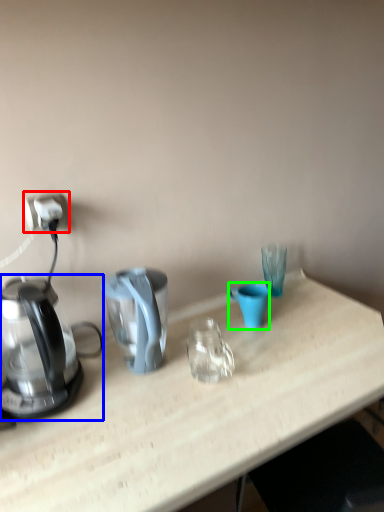
Question: Estimate the real-world distances between objects in this image. Which object is farther from power outlet (highlighted by a red box), kettle (highlighted by a blue box) or coffee cup (highlighted by a green box)?

Choices:
 (A) kettle
 (B) coffee cup

Answer: (B)